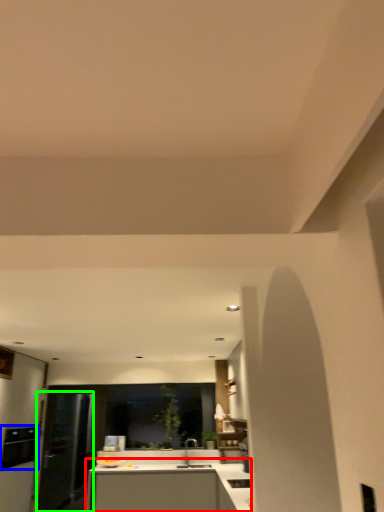
Question: Considering the real-world distances, which object is farthest from countertop (highlighted by a red box)? appliance (highlighted by a blue box) or glass door (highlighted by a green box)?

Choices:
 (A) appliance
 (B) glass door

Answer: (A)